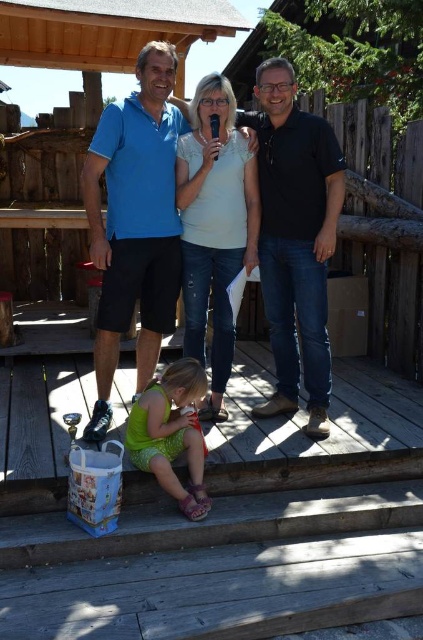
Question: Can you confirm if blue cotton shirt at center is positioned to the left of green fabric dress at lower center?

Choices:
 (A) no
 (B) yes

Answer: (B)

Question: Which point is closer to the camera taking this photo?

Choices:
 (A) (277, 291)
 (B) (202, 257)

Answer: (B)

Question: Which of the following is the closest to the observer?

Choices:
 (A) (150, 449)
 (B) (85, 429)
 (C) (147, 72)
 (D) (320, 368)

Answer: (A)

Question: Does blue cotton shirt at left appear on the right side of blue cotton shirt at center?

Choices:
 (A) no
 (B) yes

Answer: (B)

Question: Among these objects, which one is farthest from the camera?

Choices:
 (A) blue cotton shirt at left
 (B) white cotton shirt at center

Answer: (B)

Question: Is blue cotton shirt at left above dark blue polo shirt at right?

Choices:
 (A) yes
 (B) no

Answer: (A)